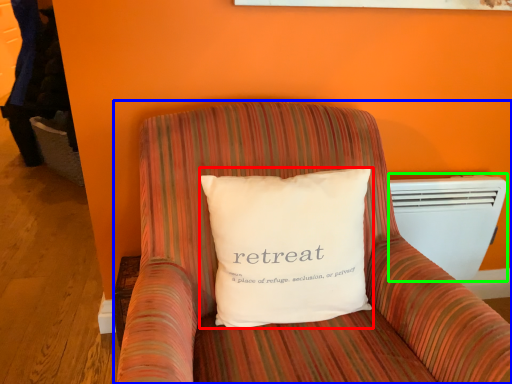
Question: Which is farther away from pillow (highlighted by a red box)? furniture (highlighted by a blue box) or air conditioning (highlighted by a green box)?

Choices:
 (A) furniture
 (B) air conditioning

Answer: (B)